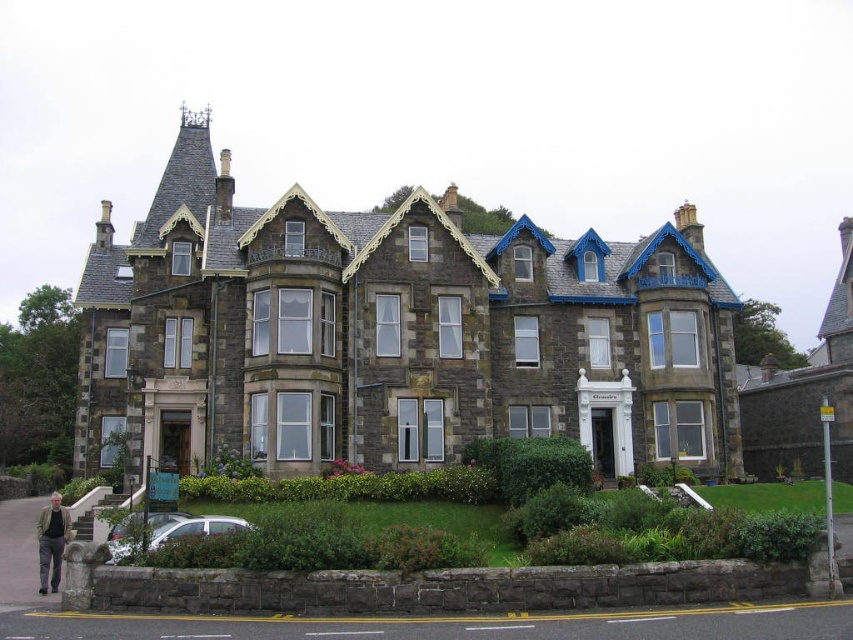
You are an architect analyzing the Victorian building. You notice the dark gray stone mansion at upper right and the light brown leather jacket at lower left. Which object is larger in size?

The dark gray stone mansion at upper right is bigger than the light brown leather jacket at lower left.

You are standing in a park and see the stone mansion at center. If you want to take a photo of it from the exact center point, where should you position yourself relative to the mansion?

To take a photo of the stone mansion at center from its exact center point at coordinates (392, 333), you should position yourself directly facing the mansion at that central coordinate point.

From the picture: You are standing in front of the stone mansion at center and want to find the light brown leather jacket at lower left. In which direction should you move to locate it?

The light brown leather jacket at lower left is to the left of the stone mansion at center, so you should move to the left to locate it.